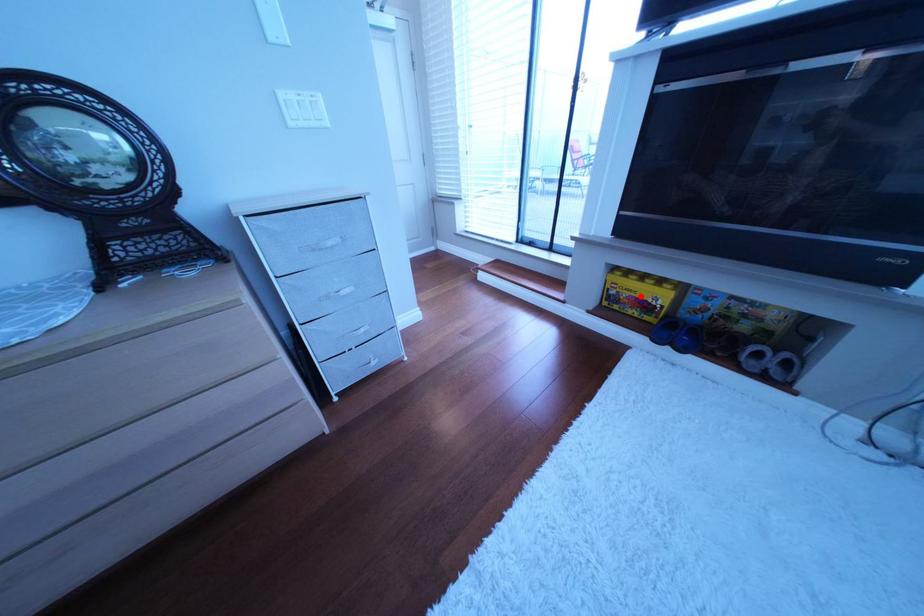
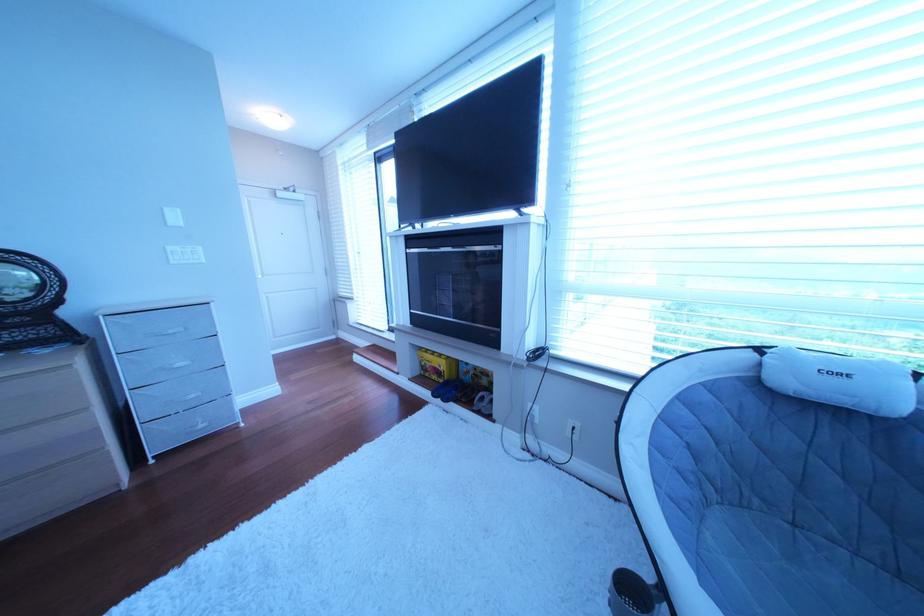
Where in the second image is the point corresponding to the highlighted location from the first image?

(444, 367)